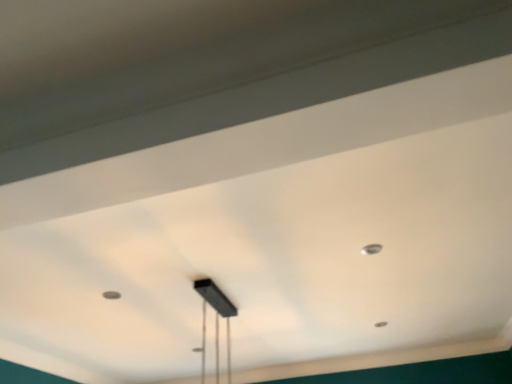
Question: Can you confirm if metallic silver dot at upper right is shorter than black matte rectangular light fixture at center?

Choices:
 (A) yes
 (B) no

Answer: (A)

Question: Is black matte rectangular light fixture at center at the back of metallic silver dot at upper right?

Choices:
 (A) no
 (B) yes

Answer: (A)

Question: Is metallic silver dot at upper right smaller than black matte rectangular light fixture at center?

Choices:
 (A) yes
 (B) no

Answer: (A)

Question: Is metallic silver dot at upper right outside black matte rectangular light fixture at center?

Choices:
 (A) yes
 (B) no

Answer: (A)

Question: Is metallic silver dot at upper right far away from black matte rectangular light fixture at center?

Choices:
 (A) yes
 (B) no

Answer: (A)

Question: Can you confirm if metallic silver dot at upper right is taller than black matte rectangular light fixture at center?

Choices:
 (A) yes
 (B) no

Answer: (B)

Question: From a real-world perspective, is black matte rectangular light fixture at center positioned over metallic silver dot at upper right based on gravity?

Choices:
 (A) yes
 (B) no

Answer: (B)

Question: Considering the relative sizes of black matte rectangular light fixture at center and metallic silver dot at upper right in the image provided, is black matte rectangular light fixture at center taller than metallic silver dot at upper right?

Choices:
 (A) no
 (B) yes

Answer: (B)

Question: Is black matte rectangular light fixture at center positioned before metallic silver dot at upper right?

Choices:
 (A) yes
 (B) no

Answer: (A)

Question: Is black matte rectangular light fixture at center next to metallic silver dot at upper right and touching it?

Choices:
 (A) yes
 (B) no

Answer: (B)

Question: Can you confirm if black matte rectangular light fixture at center is thinner than metallic silver dot at upper right?

Choices:
 (A) no
 (B) yes

Answer: (A)

Question: Could you tell me if black matte rectangular light fixture at center is turned towards metallic silver dot at upper right?

Choices:
 (A) yes
 (B) no

Answer: (A)

Question: Considering the positions of black matte rectangular light fixture at center and metallic silver dot at upper right in the image, is black matte rectangular light fixture at center bigger or smaller than metallic silver dot at upper right?

Choices:
 (A) small
 (B) big

Answer: (B)